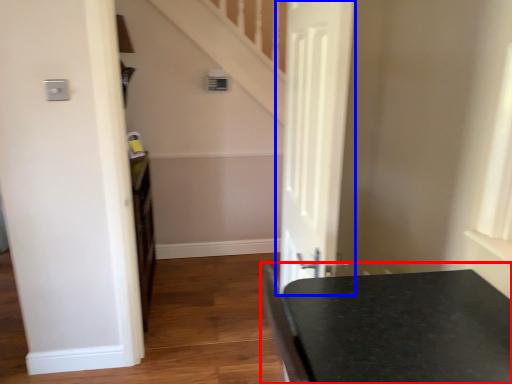
Question: Which of the following is the closest to the observer, table (highlighted by a red box) or door (highlighted by a blue box)?

Choices:
 (A) table
 (B) door

Answer: (A)